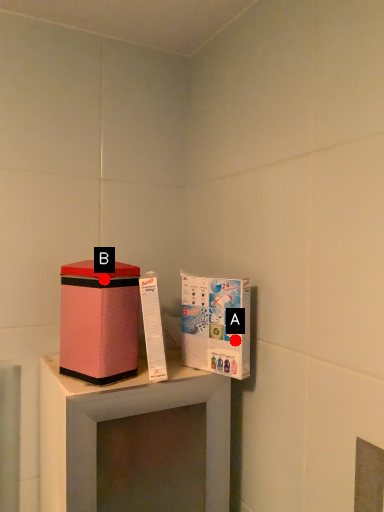
Question: Two points are circled on the image, labeled by A and B beside each circle. Which point appears closest to the camera in this image?

Choices:
 (A) A is closer
 (B) B is closer

Answer: (B)